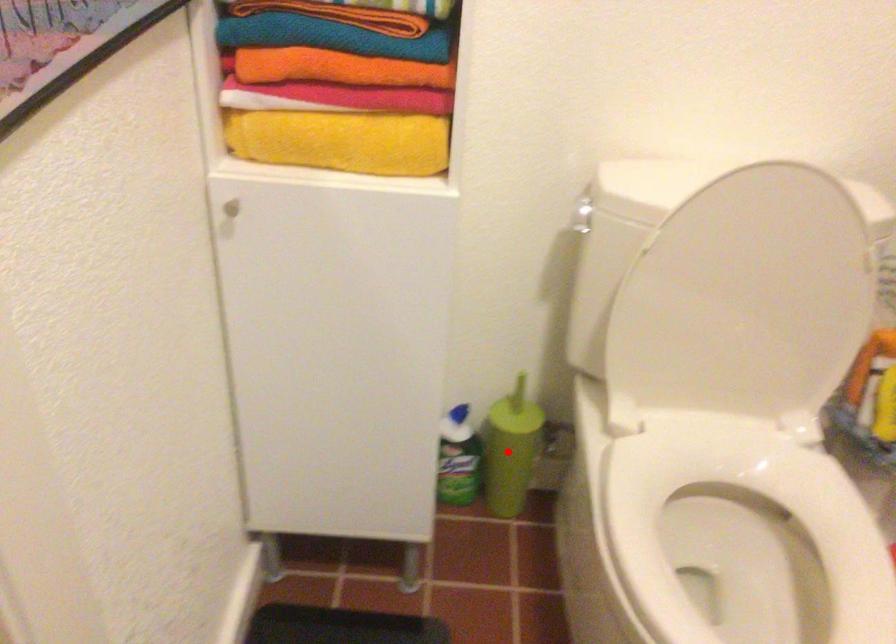
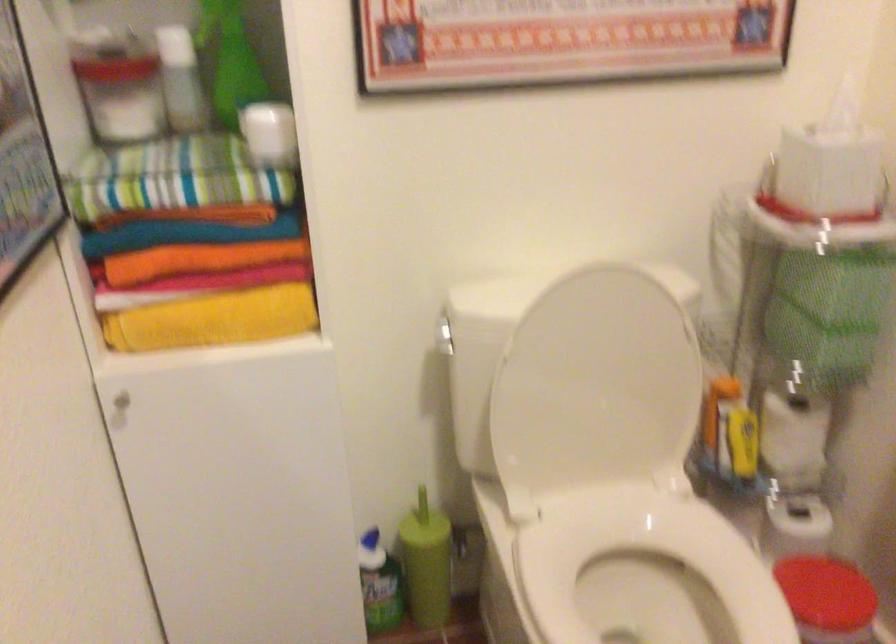
In the second image, find the point that corresponds to the highlighted location in the first image.

(426, 563)